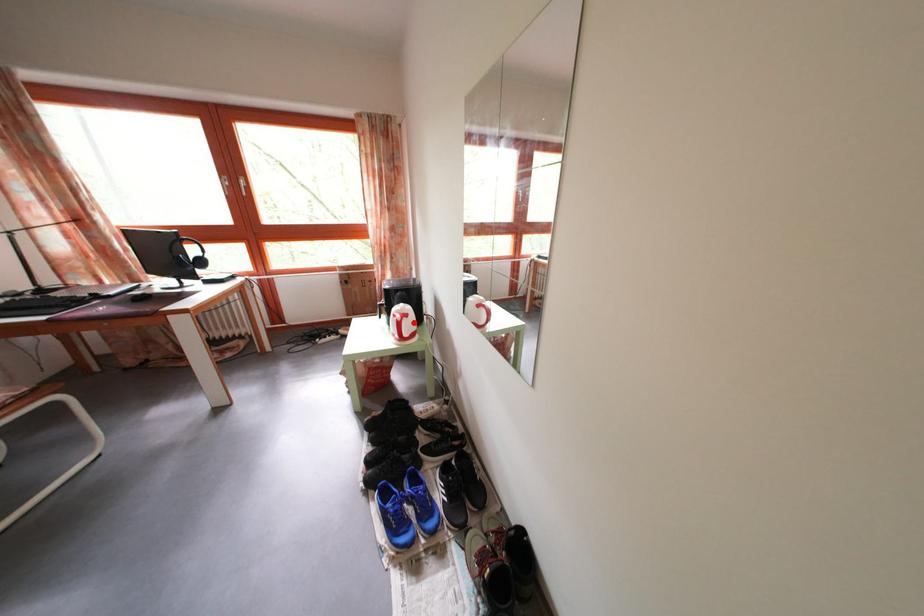
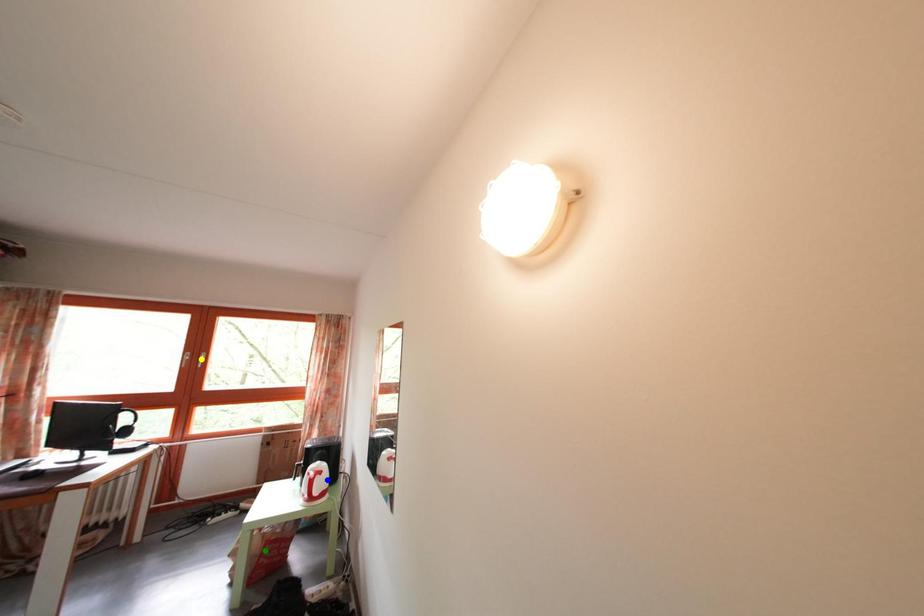
Question: I am providing you with two images of the same scene from different viewpoints. A red point is marked on the first image. You are given multiple points on the second image. Which spot in image 2 lines up with the point in image 1?

Choices:
 (A) green point
 (B) yellow point
 (C) blue point

Answer: (C)